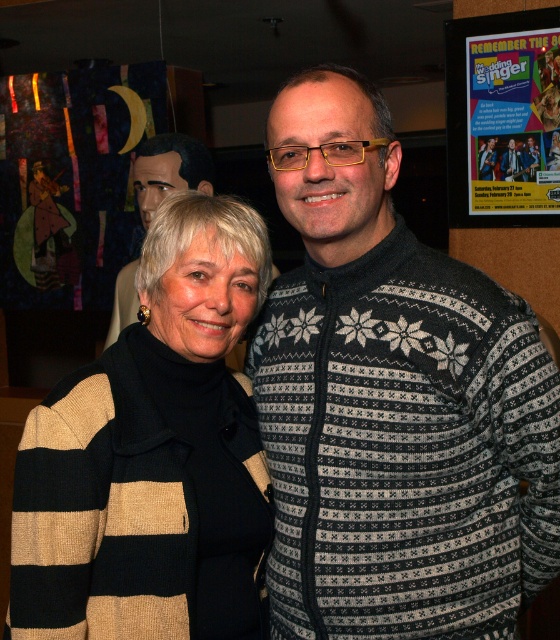
Question: Which object is positioned closest to the knitted sweater at center?

Choices:
 (A) matte paper poster at upper right
 (B) knit sweater at center

Answer: (A)

Question: Which point is farther to the camera?

Choices:
 (A) matte paper poster at upper right
 (B) knitted sweater at center
 (C) striped wool sweater at center
 (D) knit sweater at center

Answer: (A)

Question: Considering the relative positions of matte paper poster at upper right and knitted sweater at center in the image provided, where is matte paper poster at upper right located with respect to knitted sweater at center?

Choices:
 (A) right
 (B) left

Answer: (A)

Question: Is knit sweater at center wider than matte paper poster at upper right?

Choices:
 (A) yes
 (B) no

Answer: (A)

Question: Estimate the real-world distances between objects in this image. Which object is farther from the matte paper poster at upper right?

Choices:
 (A) knit sweater at center
 (B) striped wool sweater at center
 (C) knitted sweater at center

Answer: (B)

Question: Can you confirm if striped wool sweater at center is wider than knitted sweater at center?

Choices:
 (A) yes
 (B) no

Answer: (B)